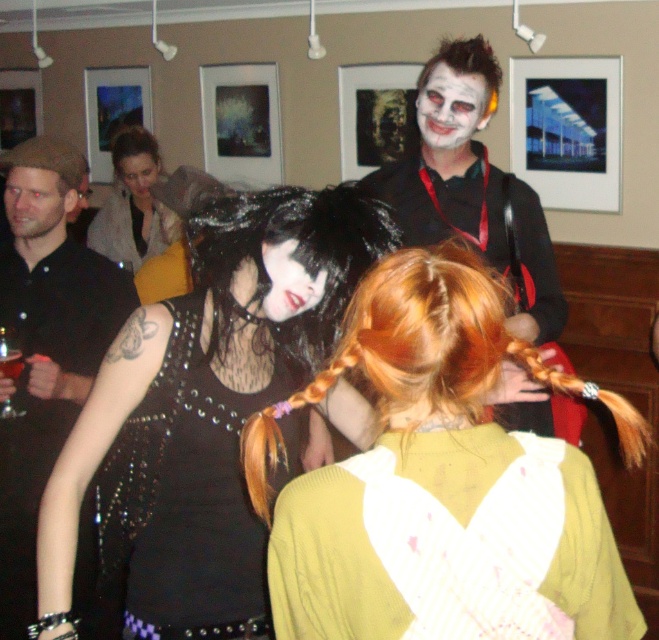
Question: Is shiny orange hair at center to the right of black studded dress at center from the viewer's perspective?

Choices:
 (A) no
 (B) yes

Answer: (B)

Question: Which object is closer to the camera taking this photo?

Choices:
 (A) studded leather vest at center
 (B) black studded dress at center
 (C) matte black wig at center

Answer: (A)

Question: Which object is positioned farthest from the shiny orange hair at center?

Choices:
 (A) black studded dress at center
 (B) matte black costume at center
 (C) matte black vest at center
 (D) metallic silver cup at center

Answer: (C)

Question: From the image, what is the correct spatial relationship of matte black costume at center in relation to metallic silver cup at center?

Choices:
 (A) left
 (B) right

Answer: (B)

Question: Among these points, which one is nearest to the camera?

Choices:
 (A) (140, 154)
 (B) (123, 216)
 (C) (3, 371)

Answer: (C)

Question: Is shiny orange hair at center thinner than matte black face at center?

Choices:
 (A) yes
 (B) no

Answer: (B)